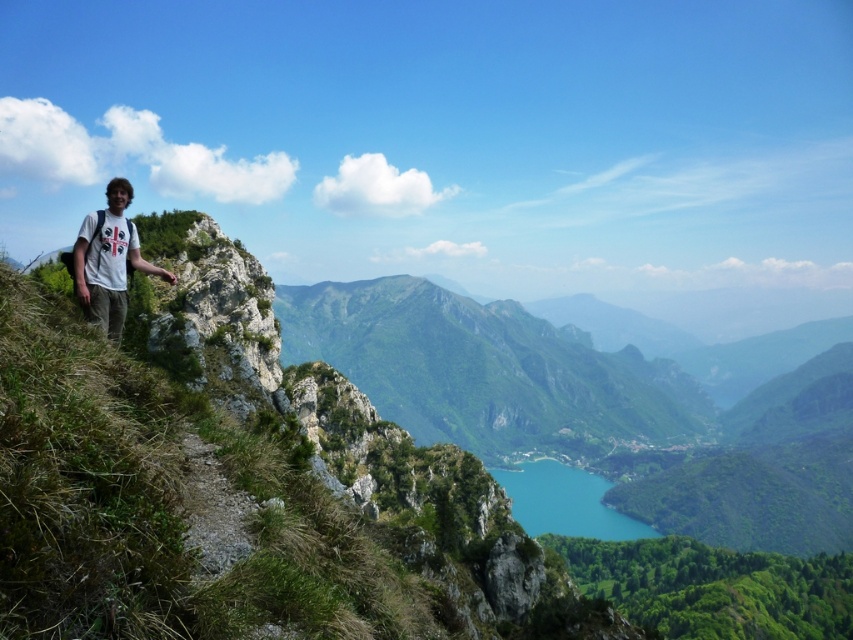
Question: Is turquoise glassy lake at center further to camera compared to white cotton shirt at upper left?

Choices:
 (A) yes
 (B) no

Answer: (A)

Question: Can you confirm if turquoise glassy lake at center is smaller than white cotton shirt at upper left?

Choices:
 (A) no
 (B) yes

Answer: (A)

Question: Is turquoise glassy lake at center above white cotton shirt at upper left?

Choices:
 (A) no
 (B) yes

Answer: (A)

Question: Which object is farther from the camera taking this photo?

Choices:
 (A) white cotton shirt at upper left
 (B) turquoise glassy lake at center

Answer: (B)

Question: Which point appears farthest from the camera in this image?

Choices:
 (A) pyautogui.click(x=120, y=307)
 (B) pyautogui.click(x=517, y=518)

Answer: (B)